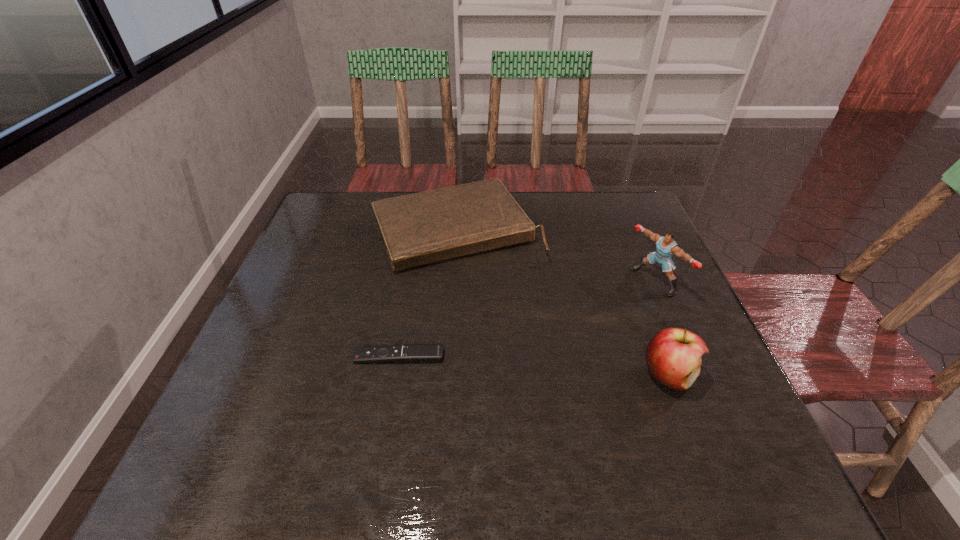
Where is `free spot between the tallest object and the shortest object`? The height and width of the screenshot is (540, 960). free spot between the tallest object and the shortest object is located at coordinates (527, 319).

Locate which object is the third closest to the shortest object. Please provide its 2D coordinates. Your answer should be formatted as a tuple, i.e. [(x, y)], where the tuple contains the x and y coordinates of a point satisfying the conditions above.

[(666, 246)]

I want to click on the second closest object relative to the second tallest object, so click(x=425, y=227).

The image size is (960, 540). Find the location of `free space in the image that satisfies the following two spatial constraints: 1. on the back side of the shortest object; 2. on the right side of the puncher`. free space in the image that satisfies the following two spatial constraints: 1. on the back side of the shortest object; 2. on the right side of the puncher is located at coordinates 412,280.